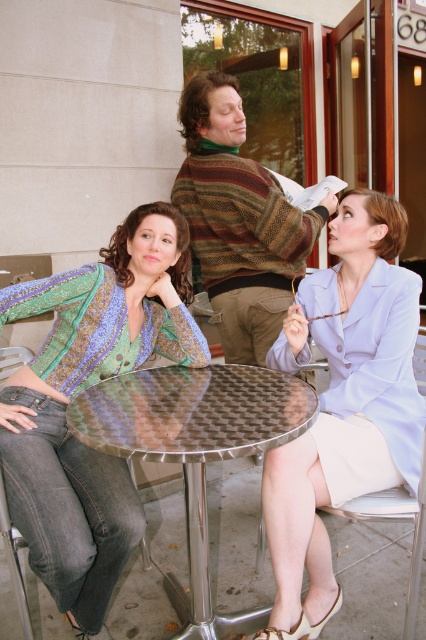
Based on the photo, between metallic hexagonal table at center and striped sweater at center, which one appears on the right side from the viewer's perspective?

striped sweater at center is more to the right.

Is metallic hexagonal table at center below striped sweater at center?

Correct, metallic hexagonal table at center is located below striped sweater at center.

Which is behind, point (256, 436) or point (241, 192)?

The point (241, 192) is behind.

At what (x,y) coordinates should I click in order to perform the action: click on metallic hexagonal table at center. Please return your answer as a coordinate pair (x, y). Looking at the image, I should click on (195, 445).

Is light blue fabric jacket at center further to camera compared to white fabric chair at lower right?

No, it is in front of white fabric chair at lower right.

Between light blue fabric jacket at center and white fabric chair at lower right, which one has more height?

Standing taller between the two is light blue fabric jacket at center.

Does point (331, 396) lie behind point (412, 516)?

That is True.

Image resolution: width=426 pixels, height=640 pixels. I want to click on light blue fabric jacket at center, so click(344, 403).

Which of these two, patterned fabric blouse at center or striped sweater at center, stands taller?

Standing taller between the two is patterned fabric blouse at center.

What do you see at coordinates (80, 390) in the screenshot? The width and height of the screenshot is (426, 640). I see `patterned fabric blouse at center` at bounding box center [80, 390].

At what (x,y) coordinates should I click in order to perform the action: click on patterned fabric blouse at center. Please return your answer as a coordinate pair (x, y). The height and width of the screenshot is (640, 426). Looking at the image, I should click on (80, 390).